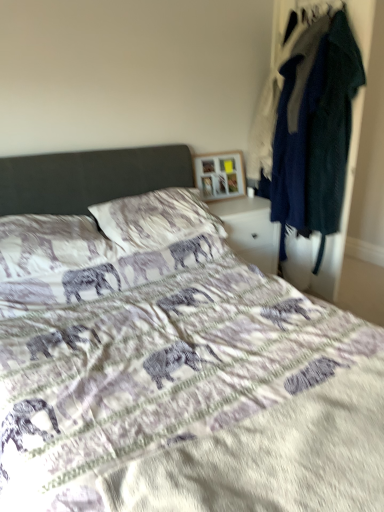
Image resolution: width=384 pixels, height=512 pixels. Describe the element at coordinates (156, 219) in the screenshot. I see `textured white pillow at center, arranged as the 2th pillow when viewed from the left` at that location.

Locate an element on the screen. The width and height of the screenshot is (384, 512). printed fabric bed at center is located at coordinates (176, 373).

In the scene shown: Considering the positions of objects wooden picture frame at upper center and textured white pillow at center, acting as the 1th pillow starting from the right, in the image provided, who is more to the left, wooden picture frame at upper center or textured white pillow at center, acting as the 1th pillow starting from the right,?

Result: textured white pillow at center, acting as the 1th pillow starting from the right, is more to the left.

Is textured white pillow at center, arranged as the 2th pillow when viewed from the left, inside wooden picture frame at upper center?

No, textured white pillow at center, arranged as the 2th pillow when viewed from the left, is not surrounded by wooden picture frame at upper center.

Locate an element on the screen. The width and height of the screenshot is (384, 512). picture frame that appears on the right of textured white pillow at center, arranged as the 2th pillow when viewed from the left is located at coordinates (220, 175).

Is wooden picture frame at upper center not near textured white pillow at center, arranged as the 2th pillow when viewed from the left?

No, wooden picture frame at upper center is not far from textured white pillow at center, arranged as the 2th pillow when viewed from the left.

Is white glossy nightstand at center wider or thinner than textured white pillow at center, arranged as the 2th pillow when viewed from the left?

Considering their sizes, white glossy nightstand at center looks broader than textured white pillow at center, arranged as the 2th pillow when viewed from the left.

Which is behind, point (236, 233) or point (154, 215)?

The point (236, 233) is more distant.

From the image's perspective, is white glossy nightstand at center over textured white pillow at center, arranged as the 2th pillow when viewed from the left?

No, from the image's perspective, white glossy nightstand at center is not above textured white pillow at center, arranged as the 2th pillow when viewed from the left.

Find the location of a particular element. The width and height of the screenshot is (384, 512). nightstand beneath the textured white pillow at center, acting as the 1th pillow starting from the right (from a real-world perspective) is located at coordinates pyautogui.click(x=250, y=230).

In terms of size, does textured cotton pillow at center, acting as the first pillow starting from the left, appear bigger or smaller than printed fabric bed at center?

Clearly, textured cotton pillow at center, acting as the first pillow starting from the left, is smaller in size than printed fabric bed at center.

Considering the positions of objects textured cotton pillow at center, arranged as the 2th pillow when viewed from the right, and printed fabric bed at center in the image provided, who is behind, textured cotton pillow at center, arranged as the 2th pillow when viewed from the right, or printed fabric bed at center?

textured cotton pillow at center, arranged as the 2th pillow when viewed from the right, is further away from the camera.

From the image's perspective, is textured cotton pillow at center, arranged as the 2th pillow when viewed from the right, on top of printed fabric bed at center?

Yes.

At what (x,y) coordinates should I click in order to perform the action: click on bed located underneath the textured cotton pillow at center, arranged as the 2th pillow when viewed from the right (from a real-world perspective). Please return your answer as a coordinate pair (x, y). Looking at the image, I should click on (176, 373).

Is white glossy nightstand at center placed right next to printed fabric bed at center?

They are not placed beside each other.

Is white glossy nightstand at center further to camera compared to printed fabric bed at center?

Yes, the depth of white glossy nightstand at center is greater than that of printed fabric bed at center.

From a real-world perspective, is white glossy nightstand at center physically above printed fabric bed at center?

No, from a real-world perspective, white glossy nightstand at center is not above printed fabric bed at center.

Which of these two, white glossy nightstand at center or printed fabric bed at center, stands shorter?

Standing shorter between the two is white glossy nightstand at center.

Who is taller, printed fabric bed at center or wooden picture frame at upper center?

With more height is printed fabric bed at center.

From a real-world perspective, is printed fabric bed at center located beneath wooden picture frame at upper center?

Yes, from a real-world perspective, printed fabric bed at center is under wooden picture frame at upper center.

Considering the positions of points (353, 375) and (194, 163), is point (353, 375) closer to camera compared to point (194, 163)?

Yes, it is in front of point (194, 163).

Which is more to the left, printed fabric bed at center or wooden picture frame at upper center?

printed fabric bed at center is more to the left.

How many degrees apart are the facing directions of textured white pillow at center, acting as the 1th pillow starting from the right, and dark blue fabric coat at right?

The angle between the facing direction of textured white pillow at center, acting as the 1th pillow starting from the right, and the facing direction of dark blue fabric coat at right is 95.6 degrees.

Starting from the dark blue fabric coat at right, which pillow is the 1st one to the left? Please provide its 2D coordinates.

[(156, 219)]

Would you say wooden picture frame at upper center is part of white glossy nightstand at center's contents?

No, wooden picture frame at upper center is not a part of white glossy nightstand at center.

From a real-world perspective, is white glossy nightstand at center physically located above or below wooden picture frame at upper center?

In terms of real-world spatial position, white glossy nightstand at center is below wooden picture frame at upper center.

Which object is wider, white glossy nightstand at center or wooden picture frame at upper center?

white glossy nightstand at center is wider.

Is white glossy nightstand at center taller than wooden picture frame at upper center?

Yes, white glossy nightstand at center is taller than wooden picture frame at upper center.

You are a GUI agent. You are given a task and a screenshot of the screen. Output one action in this format:
    pyautogui.click(x=<x>, y=<y>)
    Task: Click on the picture frame that is above the textured white pillow at center, arranged as the 2th pillow when viewed from the left (from the image's perspective)
    
    Given the screenshot: What is the action you would take?
    pyautogui.click(x=220, y=175)

Identify the location of nightstand on the right of textured white pillow at center, acting as the 1th pillow starting from the right. Image resolution: width=384 pixels, height=512 pixels. (250, 230).

Which object lies further to the anchor point textured cotton pillow at center, acting as the first pillow starting from the left, wooden picture frame at upper center or printed fabric bed at center?

Based on the image, wooden picture frame at upper center appears to be further to textured cotton pillow at center, acting as the first pillow starting from the left.

From the image, which object appears to be farther from dark blue fabric coat at right, white glossy nightstand at center or textured cotton pillow at center, arranged as the 2th pillow when viewed from the right?

textured cotton pillow at center, arranged as the 2th pillow when viewed from the right, lies further to dark blue fabric coat at right than the other object.

Which object lies nearer to the anchor point white glossy nightstand at center, textured cotton pillow at center, arranged as the 2th pillow when viewed from the right, or dark blue fabric coat at right?

dark blue fabric coat at right is positioned closer to the anchor white glossy nightstand at center.

In the scene shown: Based on their spatial positions, is dark blue fabric coat at right or wooden picture frame at upper center closer to textured white pillow at center, acting as the 1th pillow starting from the right?

wooden picture frame at upper center is positioned closer to the anchor textured white pillow at center, acting as the 1th pillow starting from the right.

Estimate the real-world distances between objects in this image. Which object is further from textured white pillow at center, acting as the 1th pillow starting from the right, wooden picture frame at upper center or printed fabric bed at center?

wooden picture frame at upper center is positioned further to the anchor textured white pillow at center, acting as the 1th pillow starting from the right.

Looking at the image, which one is located further to printed fabric bed at center, dark blue fabric coat at right or textured cotton pillow at center, acting as the first pillow starting from the left?

dark blue fabric coat at right.

Based on their spatial positions, is printed fabric bed at center or dark blue fabric coat at right further from white glossy nightstand at center?

printed fabric bed at center.

Which object lies nearer to the anchor point wooden picture frame at upper center, printed fabric bed at center or dark blue fabric coat at right?

dark blue fabric coat at right lies closer to wooden picture frame at upper center than the other object.

Where is `pillow positioned between printed fabric bed at center and textured white pillow at center, acting as the 1th pillow starting from the right, from near to far`? pillow positioned between printed fabric bed at center and textured white pillow at center, acting as the 1th pillow starting from the right, from near to far is located at coordinates (50, 245).

Where is `pillow between textured cotton pillow at center, arranged as the 2th pillow when viewed from the right, and wooden picture frame at upper center, along the z-axis`? This screenshot has height=512, width=384. pillow between textured cotton pillow at center, arranged as the 2th pillow when viewed from the right, and wooden picture frame at upper center, along the z-axis is located at coordinates (156, 219).

What are the coordinates of `nightstand located between dark blue fabric coat at right and wooden picture frame at upper center in the depth direction` in the screenshot? It's located at (250, 230).

What are the coordinates of `closet located between printed fabric bed at center and wooden picture frame at upper center in the depth direction` in the screenshot? It's located at (283, 90).